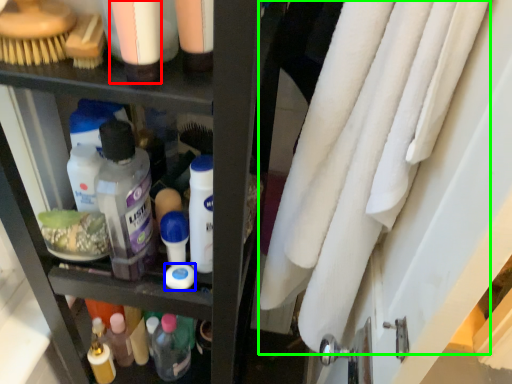
Question: Based on their relative distances, which object is nearer to toiletry (highlighted by a red box)? Choose from product (highlighted by a blue box) and bath towel (highlighted by a green box).

Choices:
 (A) product
 (B) bath towel

Answer: (B)